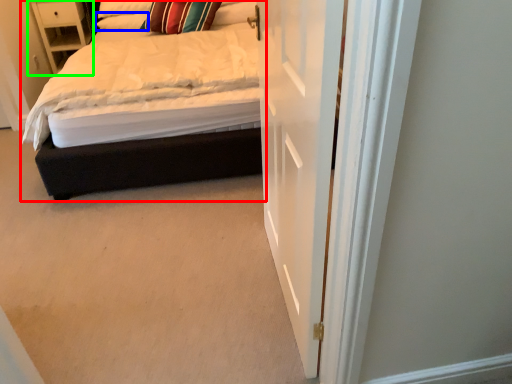
Question: Which is nearer to the bed (highlighted by a red box)? pillow (highlighted by a blue box) or nightstand (highlighted by a green box).

Choices:
 (A) pillow
 (B) nightstand

Answer: (A)